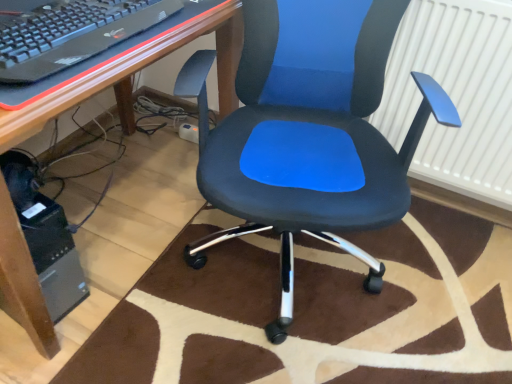
Where is `free space in front of black plastic computer tower at lower left`? The width and height of the screenshot is (512, 384). free space in front of black plastic computer tower at lower left is located at coordinates (29, 355).